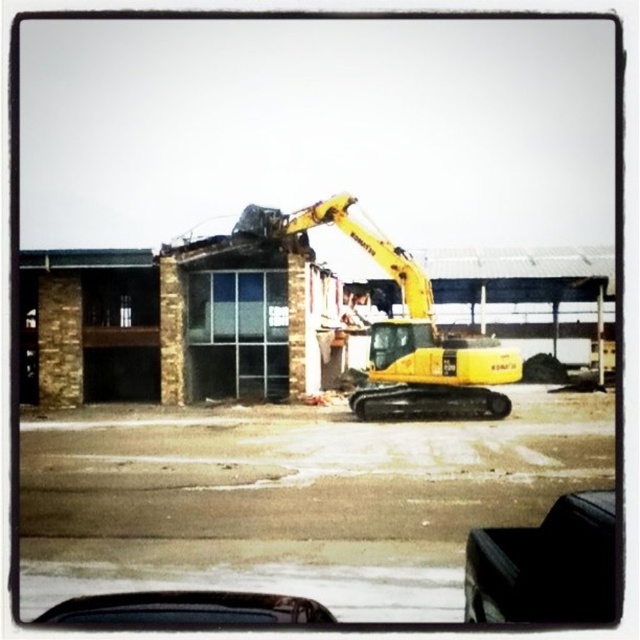
Question: Does yellow rubber excavator at center have a larger size compared to black matte car at lower center?

Choices:
 (A) yes
 (B) no

Answer: (A)

Question: From the image, what is the correct spatial relationship of black leather car at lower right in relation to black matte car at lower center?

Choices:
 (A) below
 (B) above

Answer: (B)

Question: Which of the following is the closest to the observer?

Choices:
 (A) black matte car at lower center
 (B) yellow rubber excavator at center

Answer: (A)

Question: Is black leather car at lower right in front of black matte car at lower center?

Choices:
 (A) yes
 (B) no

Answer: (A)

Question: Among these objects, which one is farthest from the camera?

Choices:
 (A) black leather car at lower right
 (B) black matte car at lower center

Answer: (B)

Question: Estimate the real-world distances between objects in this image. Which object is farther from the yellow rubber excavator at center?

Choices:
 (A) black leather car at lower right
 (B) black matte car at lower center

Answer: (A)